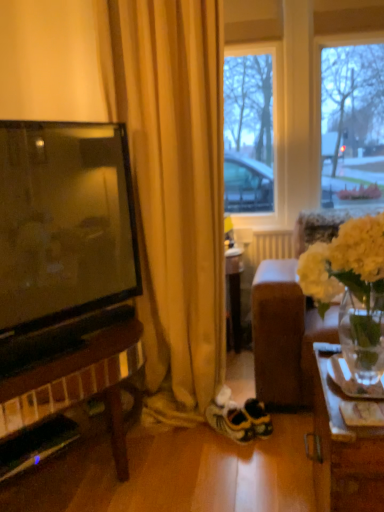
Question: Considering the positions of white fabric couch at right and white matte radiator at center in the image, is white fabric couch at right taller or shorter than white matte radiator at center?

Choices:
 (A) short
 (B) tall

Answer: (B)

Question: From a real-world perspective, is white fabric couch at right above or below white matte radiator at center?

Choices:
 (A) below
 (B) above

Answer: (B)

Question: Which of these objects is positioned farthest from the white matte radiator at center?

Choices:
 (A) white painted wood window frame at upper center
 (B) white matte vase at right
 (C) white fabric couch at right
 (D) white suede sneakers at center
 (E) yellow fabric curtain at left

Answer: (B)

Question: Which of these objects is positioned closest to the white matte radiator at center?

Choices:
 (A) white suede sneakers at center
 (B) white painted wood window frame at upper center
 (C) white matte vase at right
 (D) white fabric couch at right
 (E) yellow fabric curtain at left

Answer: (B)